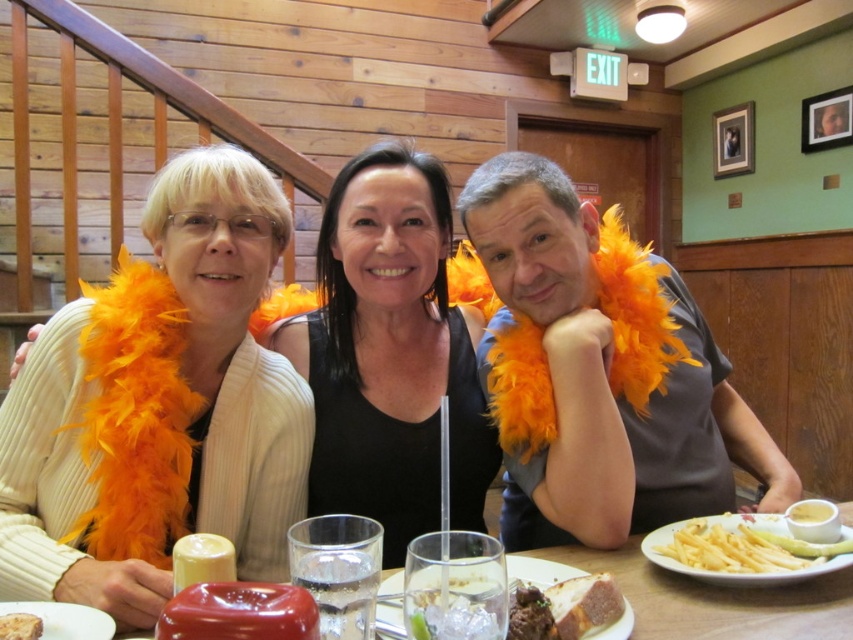
At what (x,y) coordinates should I click in order to perform the action: click on matte orange feather boa at left. Please return your answer as a coordinate pair (x, y). The image size is (853, 640). Looking at the image, I should click on (233, 352).

Can you confirm if matte orange feather boa at left is positioned to the left of golden brown crusty bread at lower center?

Yes, matte orange feather boa at left is to the left of golden brown crusty bread at lower center.

Find the location of a particular element. matte orange feather boa at left is located at coordinates (233, 352).

Is matte orange feather boa at left to the right of yellow crispy fries at lower right from the viewer's perspective?

Incorrect, matte orange feather boa at left is not on the right side of yellow crispy fries at lower right.

Is point (202, 381) farther from viewer compared to point (743, 525)?

That is True.

Who is more distant from viewer, (279, 212) or (671, 548)?

Positioned behind is point (279, 212).

This screenshot has height=640, width=853. I want to click on matte orange feather boa at left, so click(233, 352).

Can you confirm if matte orange feather boa at left is taller than matte red plate at lower left?

Correct, matte orange feather boa at left is much taller as matte red plate at lower left.

Does matte orange feather boa at left appear over matte red plate at lower left?

Correct, matte orange feather boa at left is located above matte red plate at lower left.

Is point (213, 212) behind point (99, 628)?

Yes.

Where is `matte orange feather boa at left`? matte orange feather boa at left is located at coordinates (233, 352).